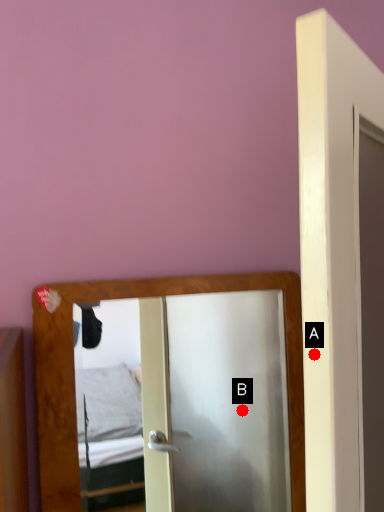
Question: Two points are circled on the image, labeled by A and B beside each circle. Which point appears farthest from the camera in this image?

Choices:
 (A) A is further
 (B) B is further

Answer: (B)